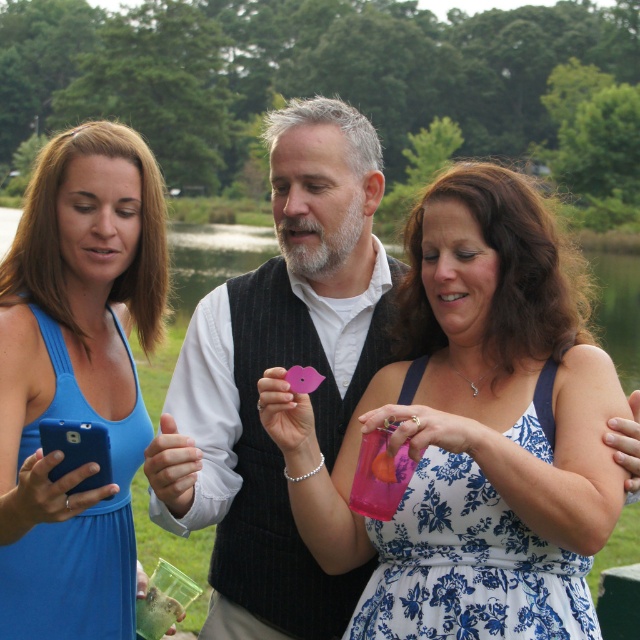
You are a photographer trying to capture a photo of the blue fabric dress at left and the blue matte smartphone at lower left. Which object should you zoom in on to ensure both are clearly visible in the frame?

The blue fabric dress at left is larger in size than the blue matte smartphone at lower left, so you should zoom in on the blue fabric dress at left to ensure both are clearly visible in the frame.

You are a photographer trying to capture a candid shot of the blue fabric dress at left and the blue matte smartphone at lower left. The minimum distance required between the two objects for your camera to focus properly is 15 centimeters. Based on the scene, will the camera be able to focus on both objects simultaneously?

The blue fabric dress at left and blue matte smartphone at lower left are 13.60 centimeters apart from each other. Since the required minimum distance is 15 centimeters, the camera cannot focus on both objects simultaneously because they are closer than the required distance.

You are a photographer trying to capture a group photo of the three people in the scene. The blue floral dress at center is positioned at coordinates 0.673, 0.739 in the image. Where should you position the camera to ensure all three are in frame?

To capture all three people, including the blue floral dress at center located at coordinates (472,429), position the camera centrally to include the entire group within the frame.